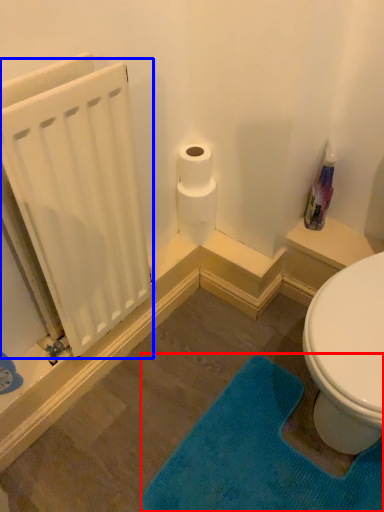
Question: Which point is closer to the camera, bath mat (highlighted by a red box) or radiator (highlighted by a blue box)?

Choices:
 (A) bath mat
 (B) radiator

Answer: (B)